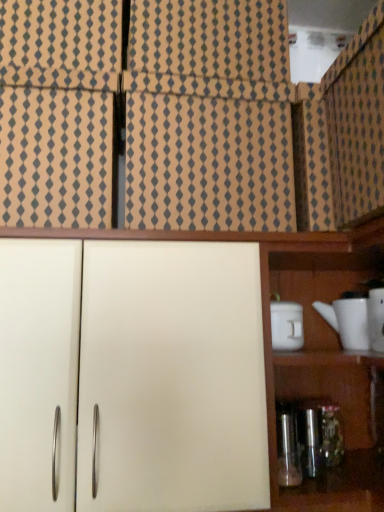
Question: Can you confirm if white matte cabinet at center, the second cabinetry from the top, is taller than white matte container at right?

Choices:
 (A) no
 (B) yes

Answer: (B)

Question: Considering the relative positions of white matte cabinet at center, marked as the first cabinetry in a bottom-to-top arrangement, and white matte container at right in the image provided, is white matte cabinet at center, marked as the first cabinetry in a bottom-to-top arrangement, to the left of white matte container at right from the viewer's perspective?

Choices:
 (A) yes
 (B) no

Answer: (A)

Question: Does white matte cabinet at center, the second cabinetry from the top, turn towards white matte container at right?

Choices:
 (A) no
 (B) yes

Answer: (B)

Question: Is white matte cabinet at center, marked as the first cabinetry in a bottom-to-top arrangement, thinner than white matte container at right?

Choices:
 (A) no
 (B) yes

Answer: (A)

Question: Are white matte cabinet at center, marked as the first cabinetry in a bottom-to-top arrangement, and white matte container at right making contact?

Choices:
 (A) no
 (B) yes

Answer: (A)

Question: Can you confirm if white matte cabinet at center, the second cabinetry from the top, is positioned to the right of white matte container at right?

Choices:
 (A) yes
 (B) no

Answer: (B)

Question: Does patterned cardboard at upper left, acting as the 1th cabinetry starting from the top, come in front of white glossy teapot at right?

Choices:
 (A) yes
 (B) no

Answer: (A)

Question: Does patterned cardboard at upper left, acting as the 1th cabinetry starting from the top, turn towards white glossy teapot at right?

Choices:
 (A) yes
 (B) no

Answer: (B)

Question: Can you confirm if patterned cardboard at upper left, acting as the 1th cabinetry starting from the top, is positioned to the right of white glossy teapot at right?

Choices:
 (A) yes
 (B) no

Answer: (B)

Question: Is patterned cardboard at upper left, acting as the 1th cabinetry starting from the top, shorter than white glossy teapot at right?

Choices:
 (A) no
 (B) yes

Answer: (A)

Question: Does patterned cardboard at upper left, acting as the 1th cabinetry starting from the top, contain white glossy teapot at right?

Choices:
 (A) yes
 (B) no

Answer: (B)

Question: Is the surface of patterned cardboard at upper left, acting as the 1th cabinetry starting from the top, in direct contact with white glossy teapot at right?

Choices:
 (A) no
 (B) yes

Answer: (A)

Question: Considering the relative sizes of white glossy teapot at right and patterned cardboard at upper left, acting as the 1th cabinetry starting from the top, in the image provided, is white glossy teapot at right thinner than patterned cardboard at upper left, acting as the 1th cabinetry starting from the top,?

Choices:
 (A) yes
 (B) no

Answer: (A)